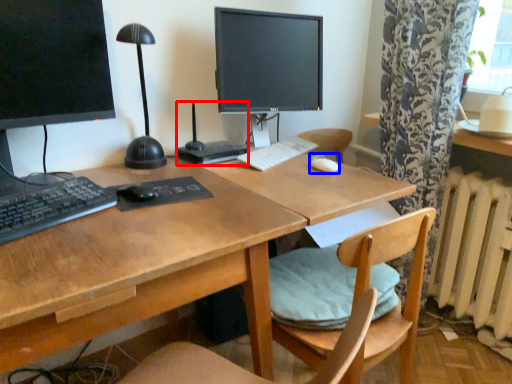
Question: Which of the following is the closest to the observer, computer (highlighted by a red box) or mouse (highlighted by a blue box)?

Choices:
 (A) computer
 (B) mouse

Answer: (A)